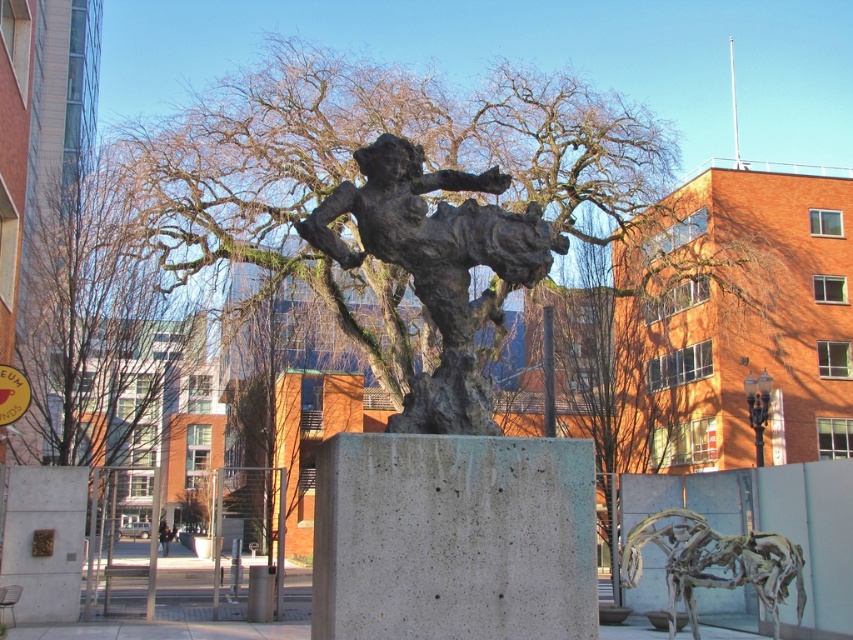
You are standing in the urban setting and want to take a photo of the sculpture. To avoid having the bare branches at center in the foreground of your photo, where should you position yourself relative to the sculpture?

The bare branches at center are located at point (97, 330), so to avoid them in the foreground, you should position yourself behind the sculpture, away from the branches.

You are an urban planner reviewing the layout of a public square. You notice a bronze textured figure at center marked by point (438, 268). Considering the surrounding buildings and trees, is the sculpture likely to cast a shadow on any of the buildings or trees during midday in winter?

The bronze textured figure at center marked by point (438, 268) is positioned centrally in the square. Given the clear blue sky and the midday sun angle in winter, the sculpture would cast a shadow directly behind it. Since the surrounding buildings are in the background and the trees are bare, the shadow would not reach them. Thus, the sculpture is unlikely to cast a shadow on any buildings or trees during midday winter.